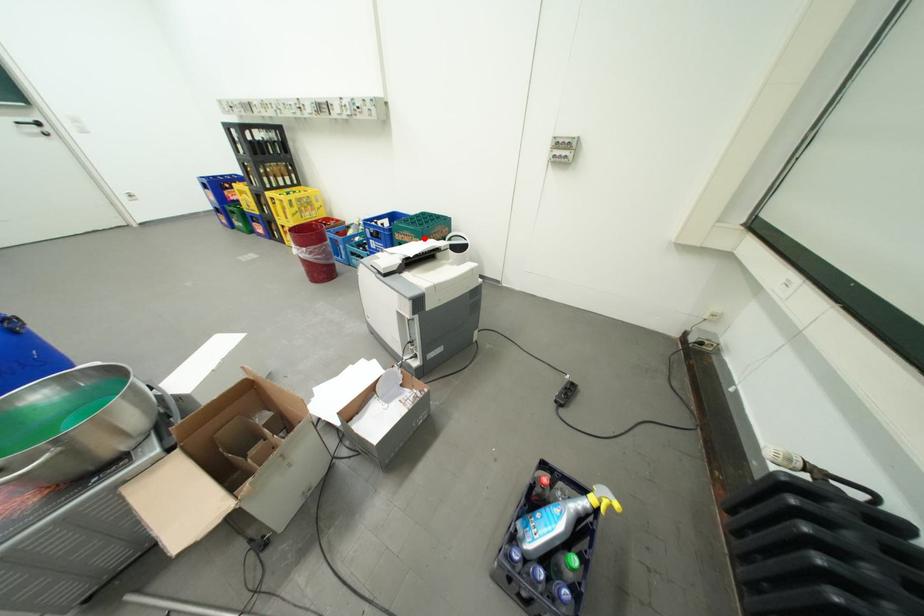
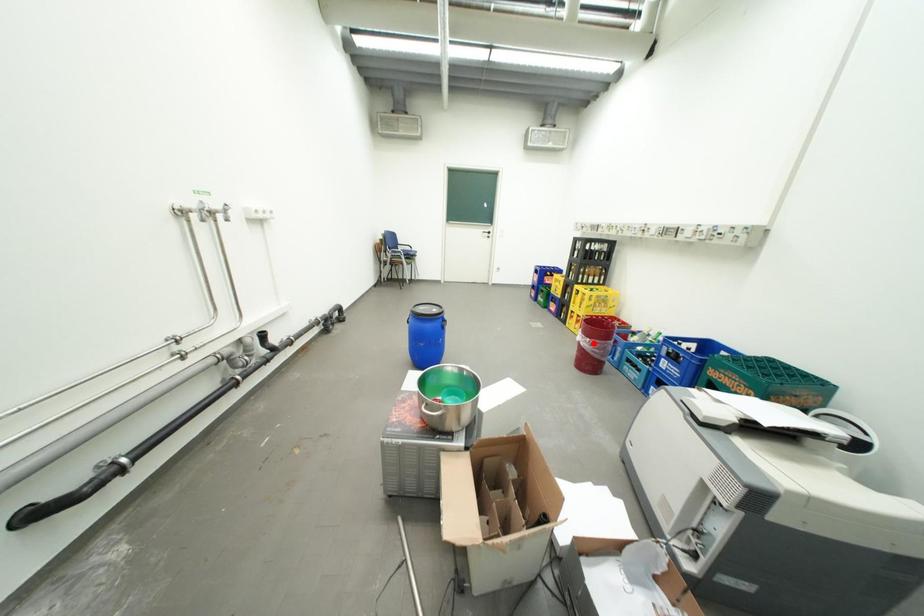
I am providing you with two images of the same scene from different viewpoints. A red point is marked on the first image and another point is marked on the second image. Do the highlighted points in image1 and image2 indicate the same real-world spot?

No